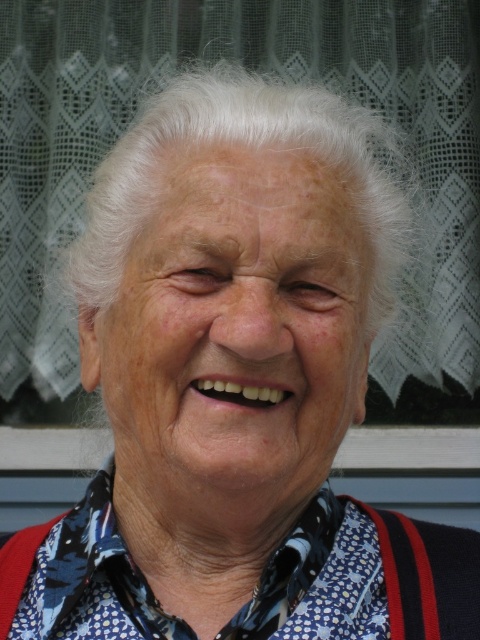
Is point (342, 396) closer to camera compared to point (336, 294)?

That is False.

Identify the location of white matte face at center. (235, 333).

Does white matte face at center have a greater height compared to light brown skin at center?

Indeed, white matte face at center has a greater height compared to light brown skin at center.

Is white matte face at center below light brown skin at center?

Yes.

Image resolution: width=480 pixels, height=640 pixels. What do you see at coordinates (235, 333) in the screenshot? I see `white matte face at center` at bounding box center [235, 333].

Where is `white matte face at center`? white matte face at center is located at coordinates (235, 333).

Who is higher up, transparent glass window at upper center or blue printed fabric shirt at center?

transparent glass window at upper center

Who is shorter, transparent glass window at upper center or blue printed fabric shirt at center?

blue printed fabric shirt at center

What do you see at coordinates (285, 77) in the screenshot?
I see `transparent glass window at upper center` at bounding box center [285, 77].

Where is `transparent glass window at upper center`? transparent glass window at upper center is located at coordinates (285, 77).